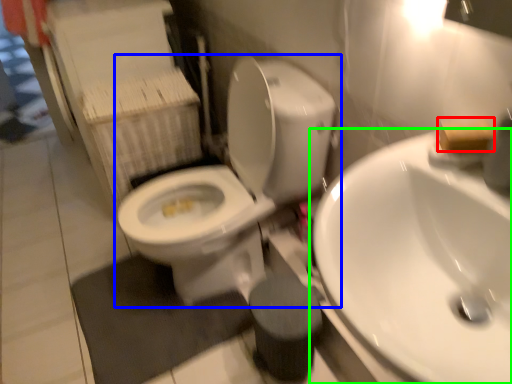
Question: Considering the real-world distances, which object is closest to soap (highlighted by a red box)? toilet (highlighted by a blue box) or sink (highlighted by a green box).

Choices:
 (A) toilet
 (B) sink

Answer: (B)